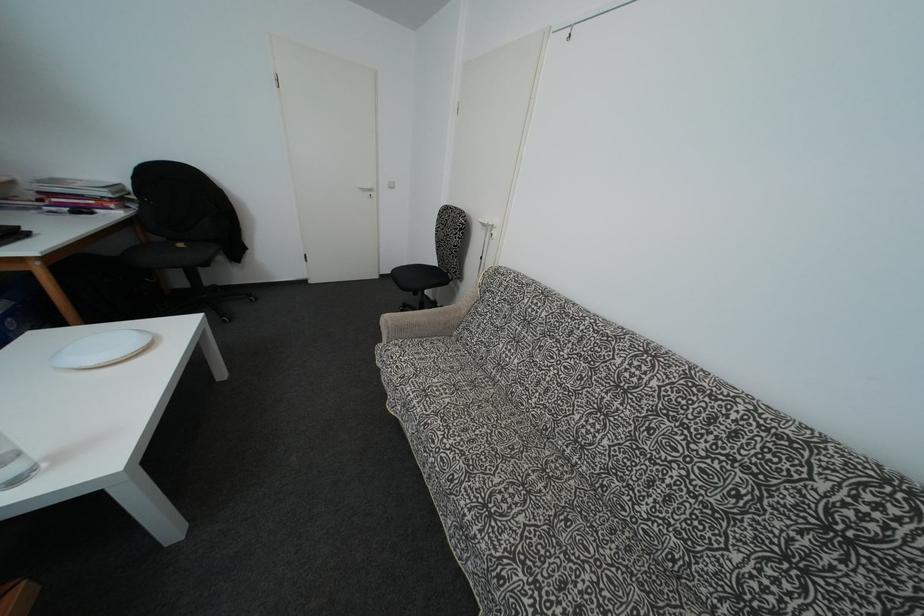
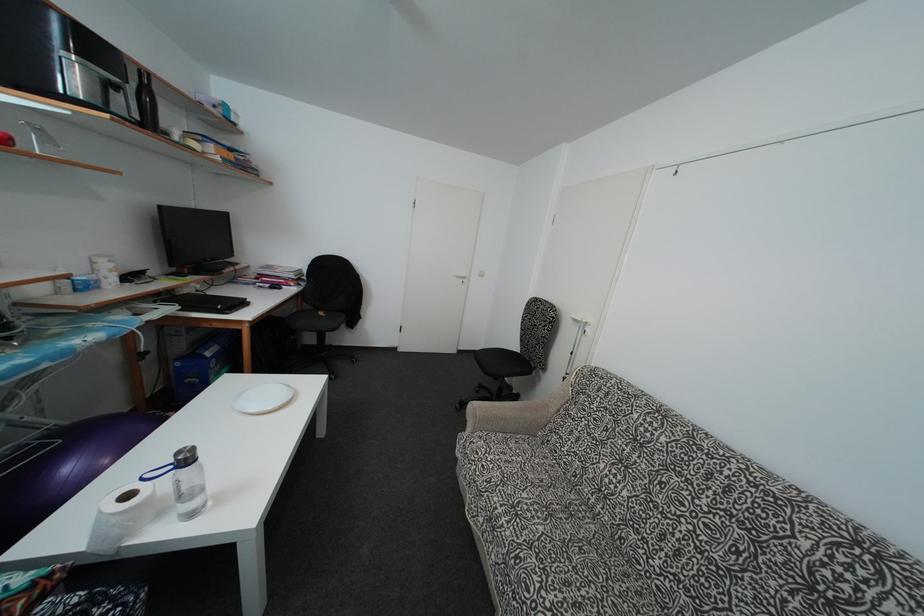
Based on the continuous images, in which direction is the camera rotating?

The camera's rotation is toward left-up.